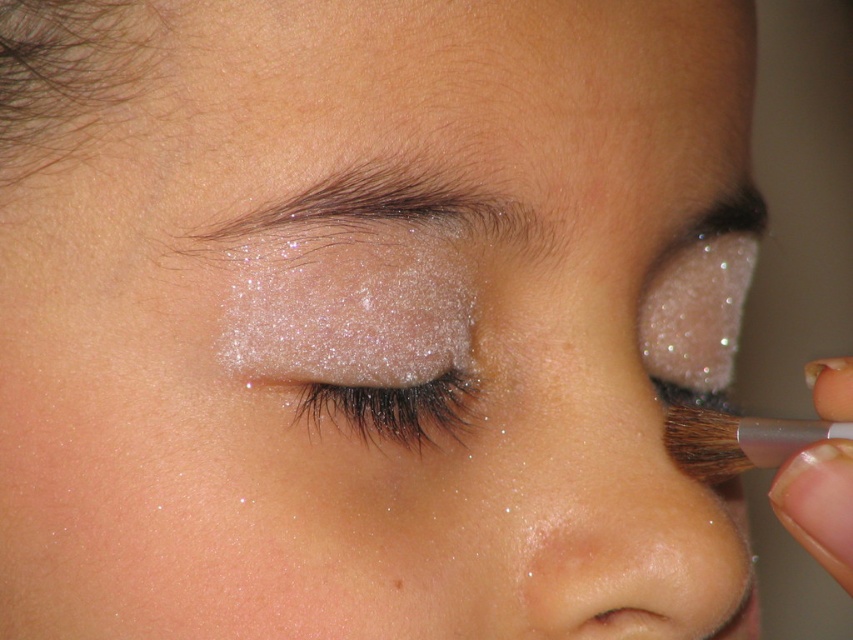
You are a makeup artist observing the application of eyeshadow. You notice two points on the face where the brush is moving. The first point is at coordinates point (451, 401) and the second is at point (392, 576). Which point is closer to your perspective as you look at the face?

Point (451, 401) is further to the viewer than point (392, 576), so the first point is closer to your perspective.

You are a makeup artist trying to apply the shimmering glitter eye at center and the brown matte freckle at center. Which one should you apply first according to the layering order?

The brown matte freckle at center is behind the shimmering glitter eye at center, so you should apply the brown matte freckle at center first before applying the shimmering glitter eye at center.

You are a makeup artist trying to apply glitter eyeshadow. You have two points marked on the client face. The first point is at point (316, 256) and the second point is at point (357, 403). Which point should you apply the glitter first to ensure proper layering?

Point (316, 256) should be applied first because it is in front of point (357, 403), allowing the glitter to layer correctly.